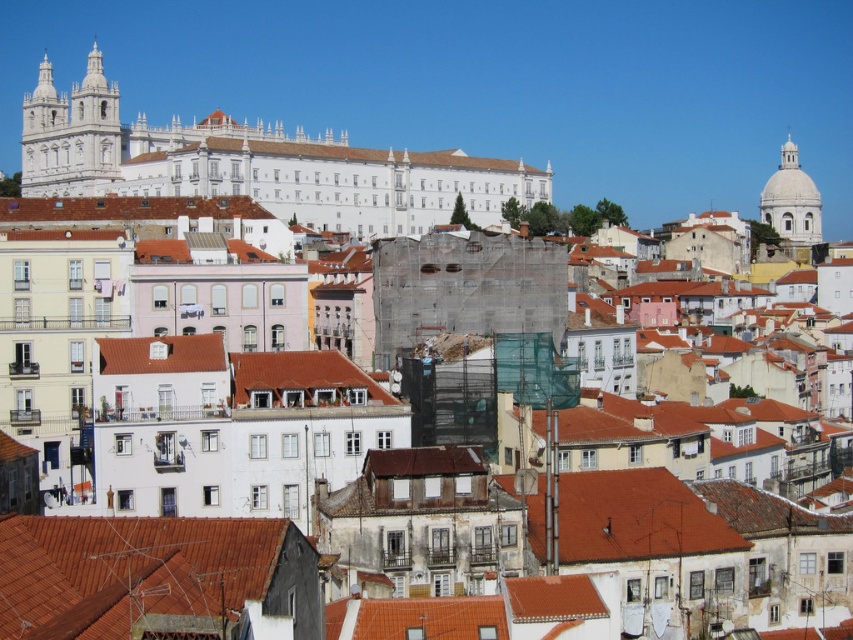
The width and height of the screenshot is (853, 640). What do you see at coordinates (161, 353) in the screenshot? I see `red tile roof at center` at bounding box center [161, 353].

Who is more distant from viewer, [175,340] or [808,195]?

Point [808,195]

Where is `red tile roof at center`? red tile roof at center is located at coordinates (161, 353).

Which is more to the right, white smooth building at center or red tile roof at center?

Positioned to the right is white smooth building at center.

Between point (218, 138) and point (151, 342), which one is positioned in front?

Point (151, 342)

Which is in front, point (508, 172) or point (189, 355)?

Point (189, 355) is in front.

Find the location of `white smooth building at center`. white smooth building at center is located at coordinates (325, 156).

Based on the photo, is brown tile roof at center to the left of red tile roof at center from the viewer's perspective?

No, brown tile roof at center is not to the left of red tile roof at center.

The image size is (853, 640). What do you see at coordinates (635, 518) in the screenshot? I see `brown tile roof at center` at bounding box center [635, 518].

Locate an element on the screen. This screenshot has width=853, height=640. brown tile roof at center is located at coordinates (635, 518).